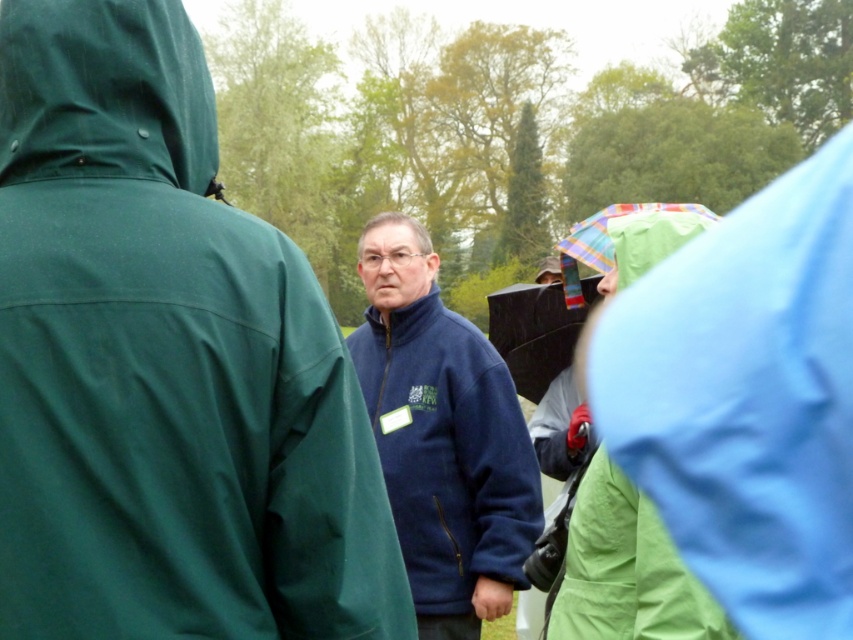
Who is lower down, navy fleece jacket at center or green matte hood at upper left?

Positioned lower is navy fleece jacket at center.

Which is behind, point (503, 564) or point (4, 120)?

Positioned behind is point (503, 564).

Locate an element on the screen. Image resolution: width=853 pixels, height=640 pixels. navy fleece jacket at center is located at coordinates 442,436.

Is point (146, 195) positioned behind point (514, 476)?

That is False.

Which is more to the left, navy blue fleece at center or navy fleece jacket at center?

From the viewer's perspective, navy blue fleece at center appears more on the left side.

Is point (15, 488) farther from camera compared to point (361, 252)?

No.

At what (x,y) coordinates should I click in order to perform the action: click on navy blue fleece at center. Please return your answer as a coordinate pair (x, y). Image resolution: width=853 pixels, height=640 pixels. Looking at the image, I should click on (165, 364).

Is point (125, 333) positioned after point (84, 4)?

No.

Is navy blue fleece at center to the left of green matte hood at upper left from the viewer's perspective?

No, navy blue fleece at center is not to the left of green matte hood at upper left.

Where is `navy blue fleece at center`? This screenshot has height=640, width=853. navy blue fleece at center is located at coordinates (165, 364).

Locate an element on the screen. The height and width of the screenshot is (640, 853). navy blue fleece at center is located at coordinates point(165,364).